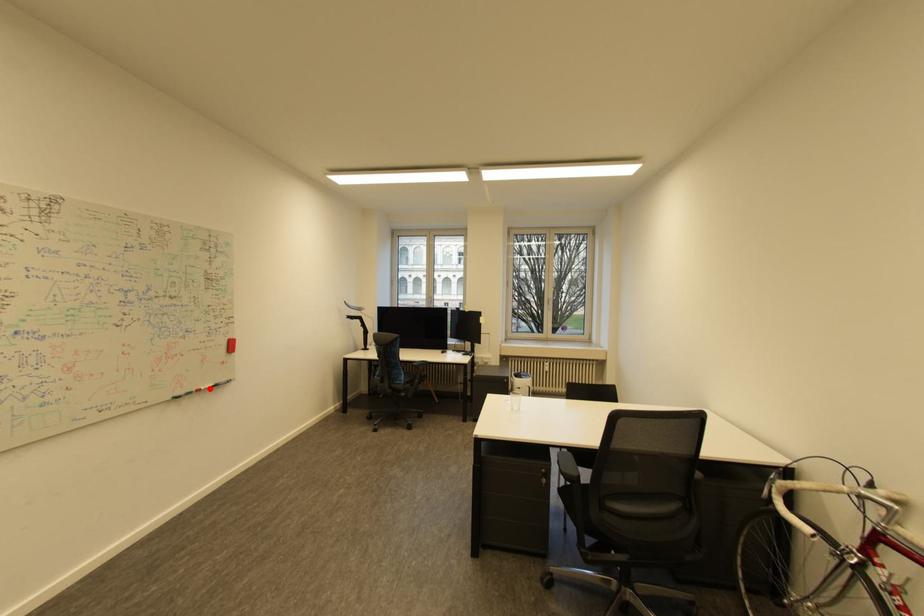
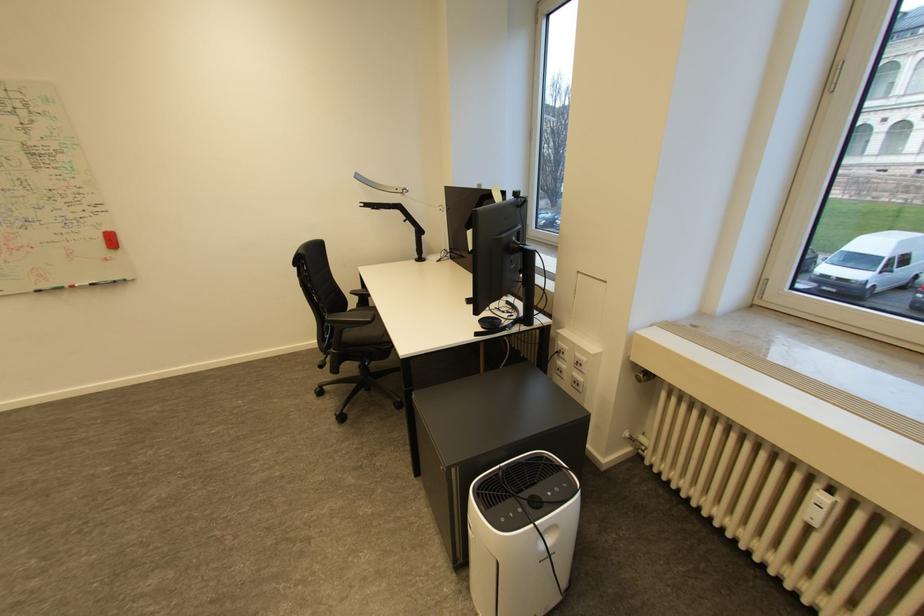
Question: I am providing you with two images of the same scene from different viewpoints. A red point is shown in image1. For the corresponding object point in image2, is it positioned nearer or farther from the camera?

Choices:
 (A) Nearer
 (B) Farther

Answer: (B)